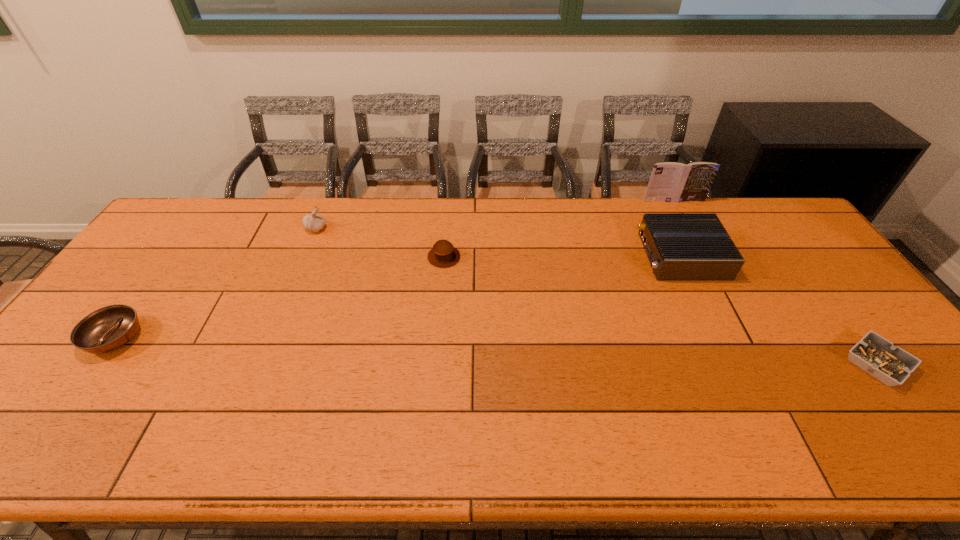
This screenshot has width=960, height=540. What are the coordinates of `the tallest object` in the screenshot? It's located at (672, 182).

Identify the location of the farthest object. This screenshot has height=540, width=960. (672, 182).

Identify the location of garlic. The image size is (960, 540). (314, 222).

At what (x,y) coordinates should I click in order to perform the action: click on router. Please return your answer as a coordinate pair (x, y). The width and height of the screenshot is (960, 540). Looking at the image, I should click on (679, 246).

Find the location of `muffin`. muffin is located at coordinates (443, 254).

The width and height of the screenshot is (960, 540). In order to click on the second shortest object in this screenshot , I will do `click(106, 329)`.

What are the coordinates of `soup bowl` in the screenshot? It's located at (106, 329).

In order to click on the shortest object in this screenshot , I will do `click(891, 365)`.

The height and width of the screenshot is (540, 960). I want to click on the rightmost object, so click(891, 365).

Locate an element on the screen. free space located 0.250m on the front cover of the farthest object is located at coordinates (699, 249).